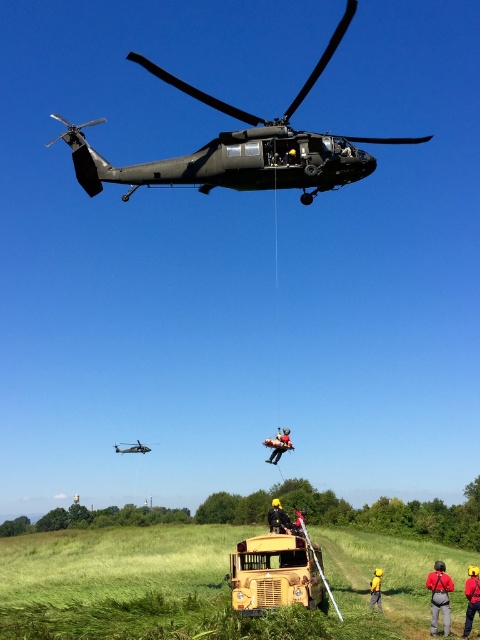
Question: Is yellow matte school bus at center closer to the viewer compared to yellow hard hat at center?

Choices:
 (A) no
 (B) yes

Answer: (B)

Question: Is yellow matte school bus at center bigger than orange fabric person at center?

Choices:
 (A) no
 (B) yes

Answer: (B)

Question: Which object appears closest to the camera in this image?

Choices:
 (A) metallic gray helicopter at upper center
 (B) yellow hard hat at center
 (C) yellow matte school bus at center
 (D) red fabric backpack at lower right

Answer: (C)

Question: Which of the following is the closest to the observer?

Choices:
 (A) (478, 602)
 (B) (431, 628)

Answer: (B)

Question: Which of these objects is positioned closest to the yellow fabric helmet at center?

Choices:
 (A) yellow fabric person at lower right
 (B) metallic gray helicopter at upper center

Answer: (A)

Question: Is matte black helicopter at upper center to the right of metallic gray helicopter at upper center from the viewer's perspective?

Choices:
 (A) no
 (B) yes

Answer: (B)